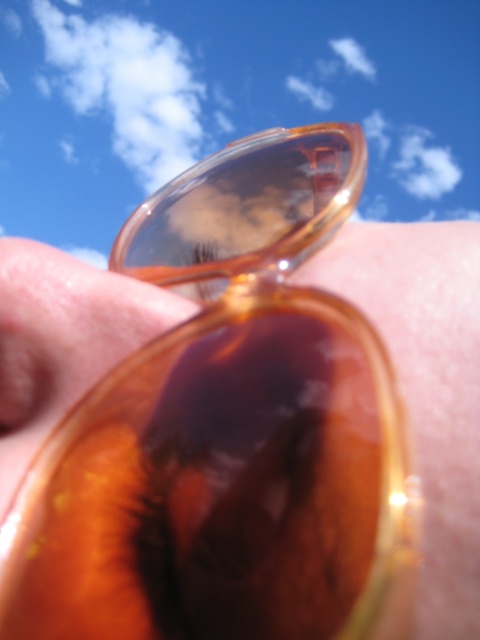
Looking at this image, you are a photographer trying to capture the reflection of the sky on the sunglasses. Since the translucent amber sunglasses at center and the translucent amber lens at center are both in the frame, which one should you focus on to ensure the sky reflection is clearly visible?

The translucent amber lens at center should be focused on because the reflection of the sky is visible on the lens, which is part of the sunglasses at center.

You are trying to locate the translucent amber sunglasses at center in the image. According to the coordinates provided, where exactly would you look?

The translucent amber sunglasses at center are located at point 0.603 on the x axis and 0.890 on the y axis.